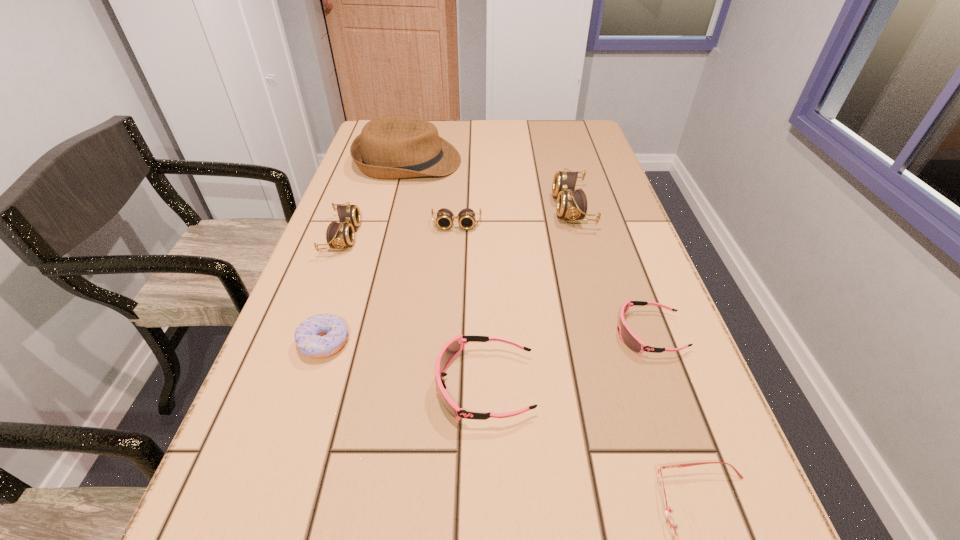
Find the location of a particular element. The width and height of the screenshot is (960, 540). vacant space located 0.080m on the front of the brown doughnut is located at coordinates (304, 403).

Find the location of a particular element. vacant space situated on the front-facing side of the right pink goggles is located at coordinates (449, 333).

You are a GUI agent. You are given a task and a screenshot of the screen. Output one action in this format:
    pyautogui.click(x=<x>, y=<y>)
    Task: Click on the vacant space situated on the front-facing side of the right pink goggles
    The image size is (960, 540).
    Given the screenshot: What is the action you would take?
    pyautogui.click(x=434, y=333)

In order to click on blank area located 0.180m on the front-facing side of the right pink goggles in this screenshot , I will do `click(522, 333)`.

Locate an element on the screen. The width and height of the screenshot is (960, 540). object that is at the far edge is located at coordinates (389, 147).

I want to click on fedora present at the left edge, so click(389, 147).

Where is `goggles located at the left edge`? Image resolution: width=960 pixels, height=540 pixels. goggles located at the left edge is located at coordinates (338, 235).

Where is `doughnut that is at the left edge`? doughnut that is at the left edge is located at coordinates (323, 335).

This screenshot has width=960, height=540. Identify the location of object that is at the far left corner. (389, 147).

Identify the location of free region at the far edge of the desktop. Image resolution: width=960 pixels, height=540 pixels. (475, 134).